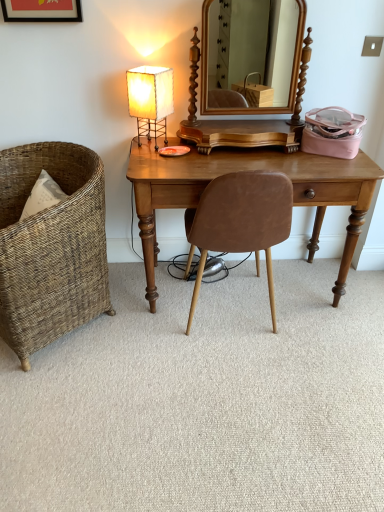
Question: Should I look upward or downward to see brown leather chair at center, placed as the second chair when sorted from left to right?

Choices:
 (A) down
 (B) up

Answer: (B)

Question: From the image's perspective, is woven wicker chair at left, arranged as the first chair when viewed from the left, beneath light brown wood desk at center?

Choices:
 (A) no
 (B) yes

Answer: (B)

Question: From the image's perspective, is woven wicker chair at left, arranged as the first chair when viewed from the left, above light brown wood desk at center?

Choices:
 (A) no
 (B) yes

Answer: (A)

Question: Is woven wicker chair at left, arranged as the second chair when viewed from the right, next to light brown wood desk at center?

Choices:
 (A) yes
 (B) no

Answer: (B)

Question: Is woven wicker chair at left, arranged as the first chair when viewed from the left, at the left side of light brown wood desk at center?

Choices:
 (A) yes
 (B) no

Answer: (A)

Question: From a real-world perspective, is woven wicker chair at left, arranged as the second chair when viewed from the right, below light brown wood desk at center?

Choices:
 (A) yes
 (B) no

Answer: (B)

Question: Is woven wicker chair at left, arranged as the first chair when viewed from the left, not close to light brown wood desk at center?

Choices:
 (A) yes
 (B) no

Answer: (B)

Question: Is light brown wood desk at center not inside woven wicker chair at left, arranged as the second chair when viewed from the right?

Choices:
 (A) no
 (B) yes

Answer: (B)

Question: Is the depth of light brown wood desk at center less than that of woven wicker chair at left, arranged as the second chair when viewed from the right?

Choices:
 (A) yes
 (B) no

Answer: (B)

Question: From the image's perspective, is light brown wood desk at center on woven wicker chair at left, arranged as the first chair when viewed from the left?

Choices:
 (A) yes
 (B) no

Answer: (A)

Question: Would you consider light brown wood desk at center to be distant from woven wicker chair at left, arranged as the second chair when viewed from the right?

Choices:
 (A) no
 (B) yes

Answer: (A)

Question: Is woven wicker chair at left, arranged as the first chair when viewed from the left, a part of light brown wood desk at center?

Choices:
 (A) no
 (B) yes

Answer: (A)

Question: Considering the relative sizes of light brown wood desk at center and woven wicker chair at left, arranged as the second chair when viewed from the right, in the image provided, is light brown wood desk at center taller than woven wicker chair at left, arranged as the second chair when viewed from the right,?

Choices:
 (A) yes
 (B) no

Answer: (B)

Question: Is woven wicker chair at left, arranged as the first chair when viewed from the left, positioned beyond the bounds of white paper lampshade at upper left?

Choices:
 (A) no
 (B) yes

Answer: (B)